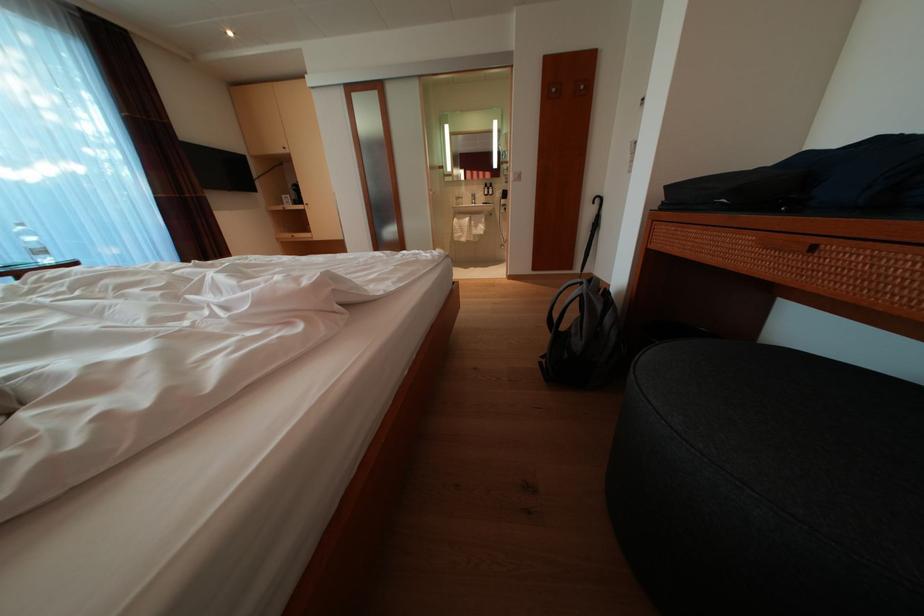
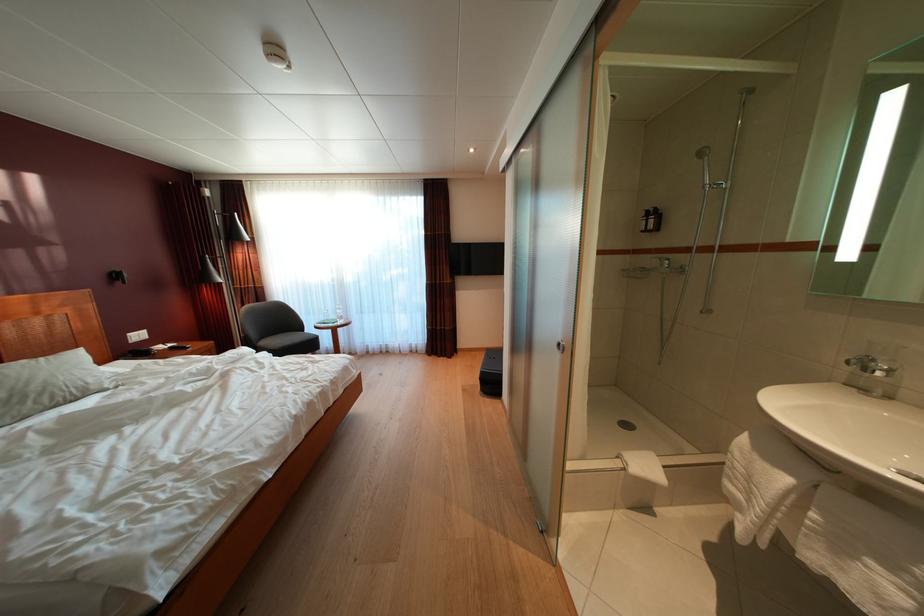
Where in the second image is the point corresponding to the point at 484,232 from the first image?

(849, 554)